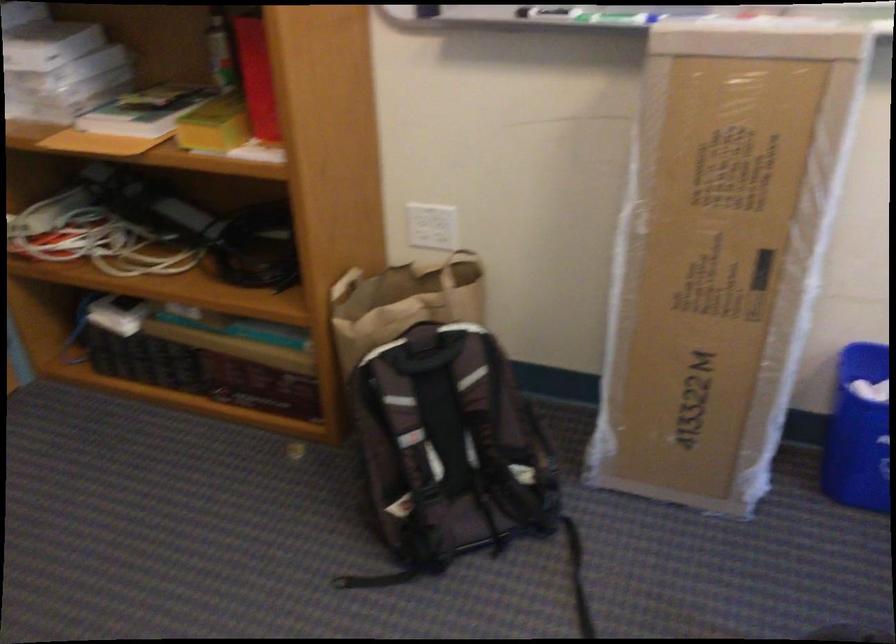
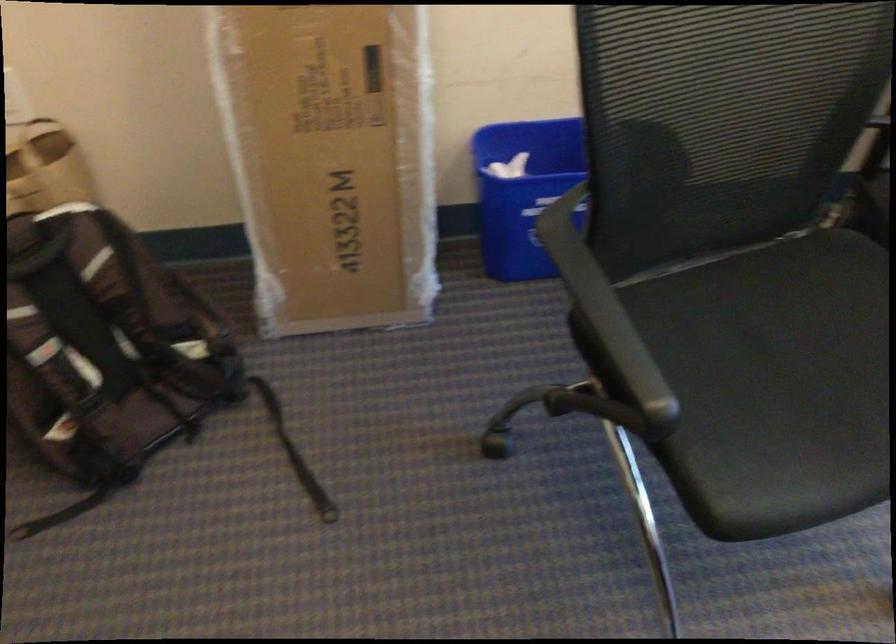
Question: The camera is either moving clockwise (left) or counter-clockwise (right) around the object. The first image is from the beginning of the video and the second image is from the end. Is the camera moving left or right when shooting the video?

Choices:
 (A) Left
 (B) Right

Answer: (A)